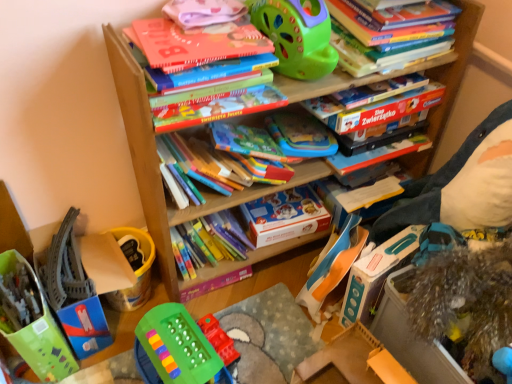
What do you see at coordinates (297, 35) in the screenshot?
I see `green plastic toy at upper center, the fourth toy when ordered from left to right` at bounding box center [297, 35].

Where is `green plastic toy at upper center, the fourth toy when ordered from left to right`? green plastic toy at upper center, the fourth toy when ordered from left to right is located at coordinates (297, 35).

Find the location of a particular element. blue plastic toy at lower right, the second toy viewed from the right is located at coordinates (333, 266).

The image size is (512, 384). In order to click on matte orange book at upper center, the 4th book in the bottom-to-top sequence in this screenshot , I will do `click(213, 92)`.

In order to click on rubberized plastic toy at center, arranged as the third toy when viewed from the left in this screenshot , I will do `click(218, 339)`.

Image resolution: width=512 pixels, height=384 pixels. Identify the location of green plastic toy at lower center, which is the second toy in left-to-right order. (175, 349).

At what (x,y) coordinates should I click in order to perform the action: click on green plastic toy at upper center, the fourth toy when ordered from left to right. Please return your answer as a coordinate pair (x, y). Looking at the image, I should click on point(297,35).

Is shiny metallic tinsel at lower right, which ranks as the 6th toy in left-to-right order, wider than multicolored plastic crayons at center, which is counted as the 2th book, starting from the bottom?

Correct, the width of shiny metallic tinsel at lower right, which ranks as the 6th toy in left-to-right order, exceeds that of multicolored plastic crayons at center, which is counted as the 2th book, starting from the bottom.

Considering the points (441, 274) and (223, 183), which point is behind, point (441, 274) or point (223, 183)?

The point (223, 183) is farther from the camera.

Does shiny metallic tinsel at lower right, positioned as the 1th toy in right-to-left order, turn towards multicolored plastic crayons at center, the 4th book viewed from the top?

No.

From the image's perspective, which one is positioned lower, shiny metallic tinsel at lower right, which ranks as the 6th toy in left-to-right order, or multicolored plastic crayons at center, the 4th book viewed from the top?

From the image's view, shiny metallic tinsel at lower right, which ranks as the 6th toy in left-to-right order, is below.

From the image's perspective, is green plastic toy at upper center, placed as the third toy when sorted from right to left, on top of matte cardboard book at upper center, the 3th book viewed from the top?

Yes.

Considering the relative positions of green plastic toy at upper center, placed as the third toy when sorted from right to left, and matte cardboard book at upper center, marked as the 3th book in a bottom-to-top arrangement, in the image provided, is green plastic toy at upper center, placed as the third toy when sorted from right to left, to the right of matte cardboard book at upper center, marked as the 3th book in a bottom-to-top arrangement, from the viewer's perspective?

No.

Is green plastic toy at upper center, the fourth toy when ordered from left to right, smaller than matte cardboard book at upper center, marked as the 3th book in a bottom-to-top arrangement?

No, green plastic toy at upper center, the fourth toy when ordered from left to right, is not smaller than matte cardboard book at upper center, marked as the 3th book in a bottom-to-top arrangement.

Looking at their sizes, would you say green plastic toy at upper center, placed as the third toy when sorted from right to left, is wider or thinner than matte cardboard book at upper center, the 3th book viewed from the top?

In the image, green plastic toy at upper center, placed as the third toy when sorted from right to left, appears to be wider than matte cardboard book at upper center, the 3th book viewed from the top.

Does point (279, 233) appear closer or farther from the camera than point (327, 291)?

Point (279, 233) appears to be farther away from the viewer than point (327, 291).

Which is more to the left, matte cardboard box at center or blue plastic toy at lower right, which is the 5th toy in left-to-right order?

matte cardboard box at center is more to the left.

Identify the location of paperback book above the blue plastic toy at lower right, which is the 5th toy in left-to-right order (from the image's perspective). (285, 216).

Would you consider matte cardboard box at center to be distant from blue plastic toy at lower right, which is the 5th toy in left-to-right order?

No, there isn't a large distance between matte cardboard box at center and blue plastic toy at lower right, which is the 5th toy in left-to-right order.

How different are the orientations of rubberized plastic toy at center, arranged as the third toy when viewed from the left, and shiny metallic tinsel at lower right, which ranks as the 6th toy in left-to-right order, in degrees?

They differ by 98 degrees in their facing directions.

Which of these two, rubberized plastic toy at center, arranged as the third toy when viewed from the left, or shiny metallic tinsel at lower right, positioned as the 1th toy in right-to-left order, stands shorter?

Standing shorter between the two is rubberized plastic toy at center, arranged as the third toy when viewed from the left.

Does point (232, 352) lie behind point (482, 287)?

Yes.

From the image's perspective, who appears lower, rubberized plastic toy at center, arranged as the third toy when viewed from the left, or shiny metallic tinsel at lower right, positioned as the 1th toy in right-to-left order?

rubberized plastic toy at center, arranged as the third toy when viewed from the left.

From a real-world perspective, which is physically below, matte orange book at upper center, acting as the 2th book starting from the top, or multicolored plastic pencils at center, the 1th book when ordered from bottom to top?

From a 3D spatial view, multicolored plastic pencils at center, the 1th book when ordered from bottom to top, is below.

Which object is more forward, matte orange book at upper center, the 4th book in the bottom-to-top sequence, or multicolored plastic pencils at center, the fifth book from the top?

matte orange book at upper center, the 4th book in the bottom-to-top sequence, is in front.

Does matte orange book at upper center, acting as the 2th book starting from the top, appear on the left side of multicolored plastic pencils at center, the fifth book from the top?

Incorrect, matte orange book at upper center, acting as the 2th book starting from the top, is not on the left side of multicolored plastic pencils at center, the fifth book from the top.

Between matte orange book at upper center, acting as the 2th book starting from the top, and multicolored plastic pencils at center, the 1th book when ordered from bottom to top, which one has more height?

Standing taller between the two is multicolored plastic pencils at center, the 1th book when ordered from bottom to top.

Considering the sizes of green plastic toy at upper center, the fourth toy when ordered from left to right, and multicolored plastic crayons at center, which is counted as the 2th book, starting from the bottom, in the image, is green plastic toy at upper center, the fourth toy when ordered from left to right, wider or thinner than multicolored plastic crayons at center, which is counted as the 2th book, starting from the bottom,?

Clearly, green plastic toy at upper center, the fourth toy when ordered from left to right, has more width compared to multicolored plastic crayons at center, which is counted as the 2th book, starting from the bottom.

Based on the photo, is green plastic toy at upper center, placed as the third toy when sorted from right to left, far away from multicolored plastic crayons at center, the 4th book viewed from the top?

green plastic toy at upper center, placed as the third toy when sorted from right to left, is near multicolored plastic crayons at center, the 4th book viewed from the top, not far away.

Which is in front, multicolored plastic crayons at center, which is counted as the 2th book, starting from the bottom, or hardcover book at upper right, the fifth book from the bottom?

hardcover book at upper right, the fifth book from the bottom.

Considering the relative sizes of multicolored plastic crayons at center, which is counted as the 2th book, starting from the bottom, and hardcover book at upper right, the fifth book from the bottom, in the image provided, is multicolored plastic crayons at center, which is counted as the 2th book, starting from the bottom, shorter than hardcover book at upper right, the fifth book from the bottom,?

Yes.

Is multicolored plastic crayons at center, the 4th book viewed from the top, surrounding hardcover book at upper right, the first book in the top-to-bottom sequence?

No, hardcover book at upper right, the first book in the top-to-bottom sequence, is not surrounded by multicolored plastic crayons at center, the 4th book viewed from the top.

From a real-world perspective, which toy is the 2nd one underneath the multicolored plastic crayons at center, which is counted as the 2th book, starting from the bottom? Please provide its 2D coordinates.

[(466, 302)]

From the green plastic toy at upper center, the fourth toy when ordered from left to right, count 1st book to the right and point to it. Please provide its 2D coordinates.

[(375, 108)]

When comparing their distances from rubberized plastic toy at center, the 4th toy viewed from the right, does matte orange book at upper center, acting as the 2th book starting from the top, or green plastic toy at lower center, which is the second toy in left-to-right order, seem closer?

green plastic toy at lower center, which is the second toy in left-to-right order, is closer to rubberized plastic toy at center, the 4th toy viewed from the right.

Looking at the image, which one is located further to green plastic toy at upper center, the fourth toy when ordered from left to right, matte cardboard book at upper center, marked as the 3th book in a bottom-to-top arrangement, or green plastic toy at lower center, which is the fifth toy from right to left?

Based on the image, green plastic toy at lower center, which is the fifth toy from right to left, appears to be further to green plastic toy at upper center, the fourth toy when ordered from left to right.

Consider the image. From the image, which object appears to be nearer to multicolored plastic crayons at center, which is counted as the 2th book, starting from the bottom, translucent plastic toy at lower left, the 1th toy when ordered from left to right, or wooden toy at lower right?

wooden toy at lower right is positioned closer to the anchor multicolored plastic crayons at center, which is counted as the 2th book, starting from the bottom.

Looking at this image, based on their spatial positions, is translucent plastic toy at lower left, the sixth toy from the right, or multicolored plastic pencils at center, the fifth book from the top, closer to matte cardboard box at center?

The object closer to matte cardboard box at center is multicolored plastic pencils at center, the fifth book from the top.

Considering their positions, is multicolored plastic pencils at center, the fifth book from the top, positioned closer to matte cardboard book at upper center, marked as the 3th book in a bottom-to-top arrangement, than shiny metallic tinsel at lower right, positioned as the 1th toy in right-to-left order?

shiny metallic tinsel at lower right, positioned as the 1th toy in right-to-left order.

From the image, which object appears to be nearer to multicolored plastic pencils at center, the fifth book from the top, wooden bookcase at center or green plastic toy at upper center, the fourth toy when ordered from left to right?

wooden bookcase at center lies closer to multicolored plastic pencils at center, the fifth book from the top, than the other object.

Looking at the image, which one is located further to blue plastic toy at lower right, which is the 5th toy in left-to-right order, green plastic toy at upper center, the fourth toy when ordered from left to right, or multicolored plastic crayons at center, which is counted as the 2th book, starting from the bottom?

Based on the image, green plastic toy at upper center, the fourth toy when ordered from left to right, appears to be further to blue plastic toy at lower right, which is the 5th toy in left-to-right order.

When comparing their distances from wooden toy at lower right, does multicolored plastic pencils at center, the 1th book when ordered from bottom to top, or matte orange book at upper center, the 4th book in the bottom-to-top sequence, seem further?

matte orange book at upper center, the 4th book in the bottom-to-top sequence.

I want to click on paperback book located between green plastic toy at lower center, which is the fifth toy from right to left, and blue plastic toy at lower right, which is the 5th toy in left-to-right order, in the left-right direction, so click(285, 216).

The image size is (512, 384). Find the location of `bookcase between hardcover book at upper right, the first book in the top-to-bottom sequence, and wooden toy at lower right vertically`. bookcase between hardcover book at upper right, the first book in the top-to-bottom sequence, and wooden toy at lower right vertically is located at coordinates (155, 161).

This screenshot has width=512, height=384. Find the location of `paperback book between hardcover book at upper right, the first book in the top-to-bottom sequence, and shiny metallic tinsel at lower right, positioned as the 1th toy in right-to-left order, from top to bottom`. paperback book between hardcover book at upper right, the first book in the top-to-bottom sequence, and shiny metallic tinsel at lower right, positioned as the 1th toy in right-to-left order, from top to bottom is located at coordinates (285, 216).

The width and height of the screenshot is (512, 384). What are the coordinates of `paperback book between multicolored plastic crayons at center, which is counted as the 2th book, starting from the bottom, and shiny metallic tinsel at lower right, positioned as the 1th toy in right-to-left order, in the horizontal direction` in the screenshot? It's located at (285, 216).